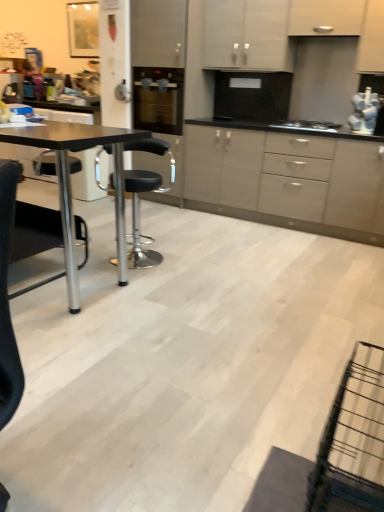
What is the approximate width of black glass gas stove at center?

black glass gas stove at center is 19.03 inches in width.

The image size is (384, 512). What do you see at coordinates (326, 17) in the screenshot? I see `white matte cabinet at upper center, which is the 2th cabinetry in top-to-bottom order` at bounding box center [326, 17].

Find the location of `white matte cabinet at upper center, which is counted as the second cabinetry, starting from the bottom`. white matte cabinet at upper center, which is counted as the second cabinetry, starting from the bottom is located at coordinates (326, 17).

The height and width of the screenshot is (512, 384). Describe the element at coordinates (138, 198) in the screenshot. I see `black leather stool at center` at that location.

How much space does matte gray cabinets at center, acting as the 3th cabinetry starting from the top, occupy vertically?

34.15 inches.

At what (x,y) coordinates should I click in order to perform the action: click on black glass gas stove at center. Please return your answer as a coordinate pair (x, y). The width and height of the screenshot is (384, 512). Looking at the image, I should click on (306, 126).

Who is taller, black glass gas stove at center or white matte cabinet at upper center, which is the 2th cabinetry in top-to-bottom order?

white matte cabinet at upper center, which is the 2th cabinetry in top-to-bottom order.

Could you measure the distance between black glass gas stove at center and white matte cabinet at upper center, which is counted as the second cabinetry, starting from the bottom?

black glass gas stove at center is 33.88 inches away from white matte cabinet at upper center, which is counted as the second cabinetry, starting from the bottom.

Considering the sizes of objects black glass gas stove at center and white matte cabinet at upper center, which is the 2th cabinetry in top-to-bottom order, in the image provided, who is thinner, black glass gas stove at center or white matte cabinet at upper center, which is the 2th cabinetry in top-to-bottom order,?

white matte cabinet at upper center, which is the 2th cabinetry in top-to-bottom order.

From a real-world perspective, who is located higher, black glass gas stove at center or white matte cabinet at upper center, which is the 2th cabinetry in top-to-bottom order?

white matte cabinet at upper center, which is the 2th cabinetry in top-to-bottom order, from a real-world perspective.

Can you confirm if white matte cabinet at upper center, which is the 2th cabinetry in top-to-bottom order, is smaller than black matte table at left?

Yes.

From a real-world perspective, who is located higher, white matte cabinet at upper center, which is the 2th cabinetry in top-to-bottom order, or black matte table at left?

From a 3D spatial view, white matte cabinet at upper center, which is the 2th cabinetry in top-to-bottom order, is above.

Considering the positions of objects white matte cabinet at upper center, which is the 2th cabinetry in top-to-bottom order, and black matte table at left in the image provided, who is more to the left, white matte cabinet at upper center, which is the 2th cabinetry in top-to-bottom order, or black matte table at left?

black matte table at left is more to the left.

Which of these two, black matte table at left or black glass oven at center, is thinner?

black glass oven at center is thinner.

Do you think black matte table at left is within black glass oven at center, or outside of it?

black matte table at left is not inside black glass oven at center, it's outside.

Between black matte table at left and black glass oven at center, which one is positioned behind?

black glass oven at center is more distant.

Is black matte table at left shorter than black glass oven at center?

In fact, black matte table at left may be taller than black glass oven at center.

From the picture: From the image's perspective, between white matte cabinet at upper center, which is the 2th cabinetry in top-to-bottom order, and black glass gas stove at center, which one is located above?

From the image's view, white matte cabinet at upper center, which is the 2th cabinetry in top-to-bottom order, is above.

Where is `the 1st cabinetry above the black glass gas stove at center (from the image's perspective)`? The width and height of the screenshot is (384, 512). the 1st cabinetry above the black glass gas stove at center (from the image's perspective) is located at coordinates (326, 17).

Is white matte cabinet at upper center, which is counted as the second cabinetry, starting from the bottom, located outside black glass gas stove at center?

Yes, white matte cabinet at upper center, which is counted as the second cabinetry, starting from the bottom, is located beyond the bounds of black glass gas stove at center.

Considering the points (323, 3) and (321, 130), which point is behind, point (323, 3) or point (321, 130)?

Point (321, 130)

Do you think matte gray cabinets at center, acting as the 3th cabinetry starting from the top, is within black glass gas stove at center, or outside of it?

matte gray cabinets at center, acting as the 3th cabinetry starting from the top, exists outside the volume of black glass gas stove at center.

Considering the sizes of objects matte gray cabinets at center, which is the 1th cabinetry from bottom to top, and black glass gas stove at center in the image provided, who is smaller, matte gray cabinets at center, which is the 1th cabinetry from bottom to top, or black glass gas stove at center?

black glass gas stove at center.

Is point (244, 153) closer to viewer compared to point (290, 122)?

Yes.

Between matte gray cabinets at center, which is the 1th cabinetry from bottom to top, and black glass gas stove at center, which one appears on the left side from the viewer's perspective?

Positioned to the left is matte gray cabinets at center, which is the 1th cabinetry from bottom to top.

Which is farther from the camera, (x=176, y=84) or (x=229, y=176)?

Positioned behind is point (x=229, y=176).

Which is more to the right, black glass oven at center or matte gray cabinets at center, which is the 1th cabinetry from bottom to top?

Positioned to the right is matte gray cabinets at center, which is the 1th cabinetry from bottom to top.

Is black glass oven at center wider than matte gray cabinets at center, acting as the 3th cabinetry starting from the top?

Yes.

How much distance is there between black glass oven at center and matte gray cabinets at center, acting as the 3th cabinetry starting from the top?

black glass oven at center and matte gray cabinets at center, acting as the 3th cabinetry starting from the top, are 33.87 inches apart from each other.

Which is nearer, (x=336, y=198) or (x=138, y=116)?

The point (x=336, y=198) is closer.

Considering the sizes of objects matte gray cabinets at center, acting as the 3th cabinetry starting from the top, and black glass oven at center in the image provided, who is smaller, matte gray cabinets at center, acting as the 3th cabinetry starting from the top, or black glass oven at center?

black glass oven at center is smaller.

Is matte gray cabinets at center, which is the 1th cabinetry from bottom to top, to the left or to the right of black glass oven at center in the image?

matte gray cabinets at center, which is the 1th cabinetry from bottom to top, is to the right of black glass oven at center.

Find the location of a particular element. The width and height of the screenshot is (384, 512). the 1st cabinetry in front of the black glass gas stove at center, counting from the anchor's position is located at coordinates (326, 17).

Find the location of a particular element. Image resolution: width=384 pixels, height=512 pixels. the 3rd cabinetry counting from the right of the black matte table at left is located at coordinates (326, 17).

Based on the photo, from the image, which object appears to be farther from black leather stool at center, black glass oven at center or black matte table at left?

Among the two, black glass oven at center is located further to black leather stool at center.

Considering their positions, is black glass oven at center positioned further to white matte cabinet at upper center, which is the 2th cabinetry in top-to-bottom order, than matte gray cabinets at center, acting as the 3th cabinetry starting from the top?

black glass oven at center.

Based on their spatial positions, is matte gray cabinets at center, which is the 1th cabinetry from bottom to top, or white matte cabinet at upper center, which is counted as the second cabinetry, starting from the bottom, further from black glass oven at center?

Based on the image, white matte cabinet at upper center, which is counted as the second cabinetry, starting from the bottom, appears to be further to black glass oven at center.

Based on their spatial positions, is white matte cabinet at upper center, which is counted as the first cabinetry, starting from the top, or black matte table at left further from black leather stool at center?

The object further to black leather stool at center is white matte cabinet at upper center, which is counted as the first cabinetry, starting from the top.

Based on their spatial positions, is black glass oven at center or black glass gas stove at center closer to white matte cabinet at upper center, which is counted as the first cabinetry, starting from the top?

black glass oven at center lies closer to white matte cabinet at upper center, which is counted as the first cabinetry, starting from the top, than the other object.

From the image, which object appears to be nearer to matte gray cabinets at center, acting as the 3th cabinetry starting from the top, black matte table at left or black glass oven at center?

Based on the image, black glass oven at center appears to be nearer to matte gray cabinets at center, acting as the 3th cabinetry starting from the top.

When comparing their distances from matte gray cabinets at center, acting as the 3th cabinetry starting from the top, does black glass oven at center or white matte cabinet at upper center, which is the 2th cabinetry in top-to-bottom order, seem further?

white matte cabinet at upper center, which is the 2th cabinetry in top-to-bottom order.

In the scene shown: Looking at the image, which one is located closer to white matte cabinet at upper center, which is counted as the third cabinetry, starting from the bottom, matte gray cabinets at center, which is the 1th cabinetry from bottom to top, or black matte table at left?

The object closer to white matte cabinet at upper center, which is counted as the third cabinetry, starting from the bottom, is matte gray cabinets at center, which is the 1th cabinetry from bottom to top.

The image size is (384, 512). Identify the location of cabinetry between white matte cabinet at upper center, which is counted as the third cabinetry, starting from the bottom, and matte gray cabinets at center, acting as the 3th cabinetry starting from the top, from top to bottom. 326,17.

Find the location of `kitchen appliance between black leather stool at center and matte gray cabinets at center, which is the 1th cabinetry from bottom to top, from left to right`. kitchen appliance between black leather stool at center and matte gray cabinets at center, which is the 1th cabinetry from bottom to top, from left to right is located at coordinates (158, 99).

Identify the location of gas stove located between black glass oven at center and white matte cabinet at upper center, which is the 2th cabinetry in top-to-bottom order, in the left-right direction. The width and height of the screenshot is (384, 512). pyautogui.click(x=306, y=126).

The image size is (384, 512). I want to click on gas stove between black matte table at left and white matte cabinet at upper center, which is the 2th cabinetry in top-to-bottom order, so click(306, 126).